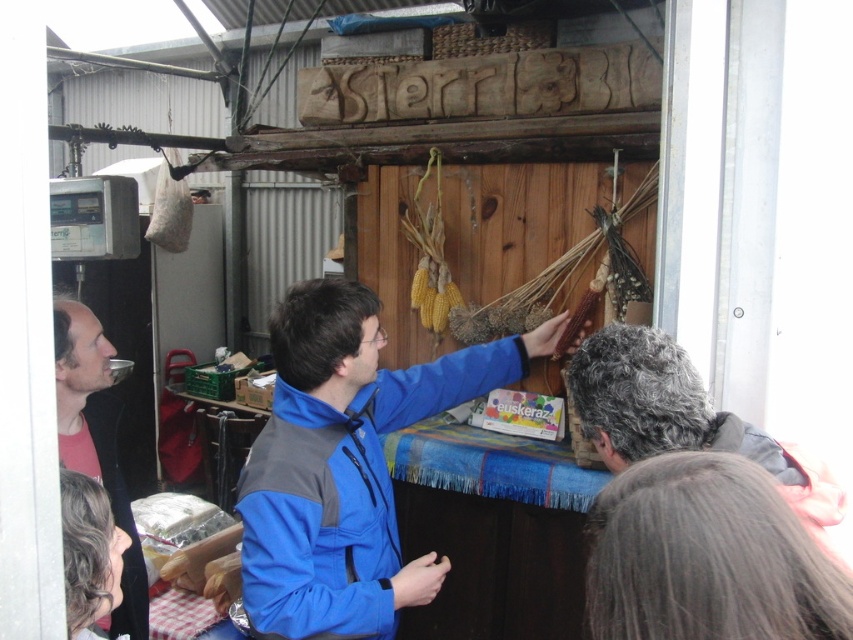
Between point (318, 544) and point (129, 618), which one is positioned behind?

The point (129, 618) is more distant.

Can you confirm if blue fleece jacket at center is bigger than matte black jacket at left?

Yes.

Find the location of a particular element. This screenshot has height=640, width=853. blue fleece jacket at center is located at coordinates (346, 465).

Does gray hair at upper center appear on the left side of matte black jacket at left?

In fact, gray hair at upper center is to the right of matte black jacket at left.

Can you confirm if gray hair at upper center is taller than matte black jacket at left?

No.

Identify the location of gray hair at upper center. (683, 419).

Where is `gray hair at upper center`? This screenshot has width=853, height=640. gray hair at upper center is located at coordinates (683, 419).

Does blue fleece jacket at center lie in front of gray hair at upper center?

No, it is behind gray hair at upper center.

Is point (386, 483) positioned behind point (683, 417)?

That is True.

Does point (393, 401) come in front of point (695, 388)?

No.

Identify the location of blue fleece jacket at center. The width and height of the screenshot is (853, 640). (346, 465).